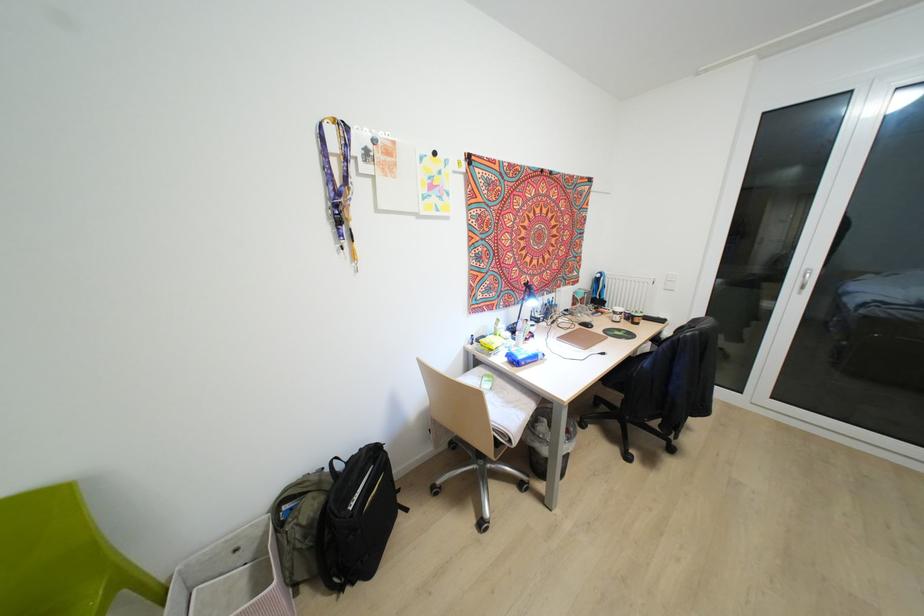
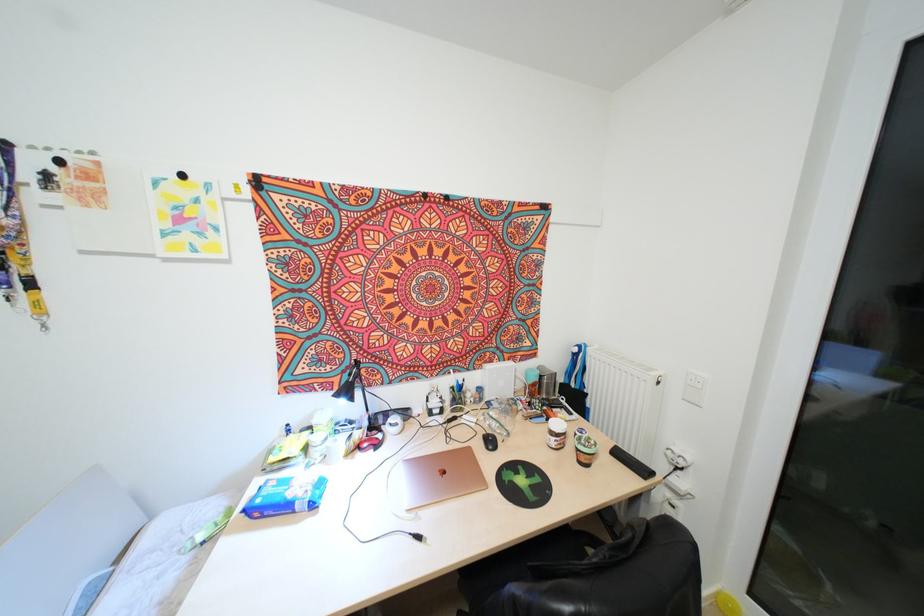
Question: I am providing you with two images of the same scene from different viewpoints. Please identify which objects are invisible in image2.

Choices:
 (A) red computer mouse
 (B) black computer mouse
 (C) black round magnet
 (D) none of these

Answer: (D)